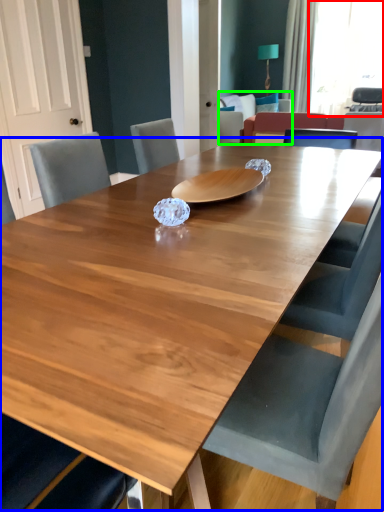
Question: Which is nearer to the window screen (highlighted by a red box)? table (highlighted by a blue box) or armchair (highlighted by a green box).

Choices:
 (A) table
 (B) armchair

Answer: (B)